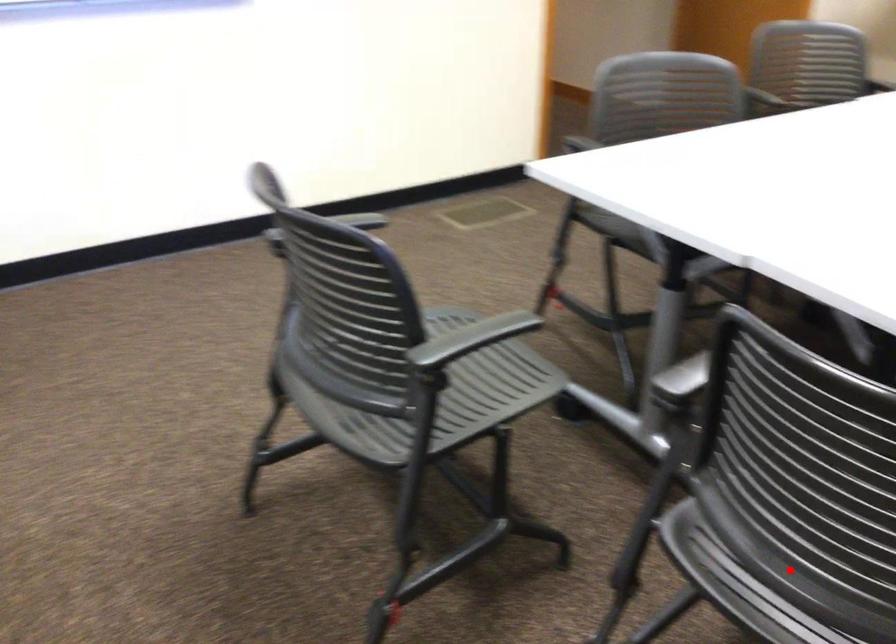
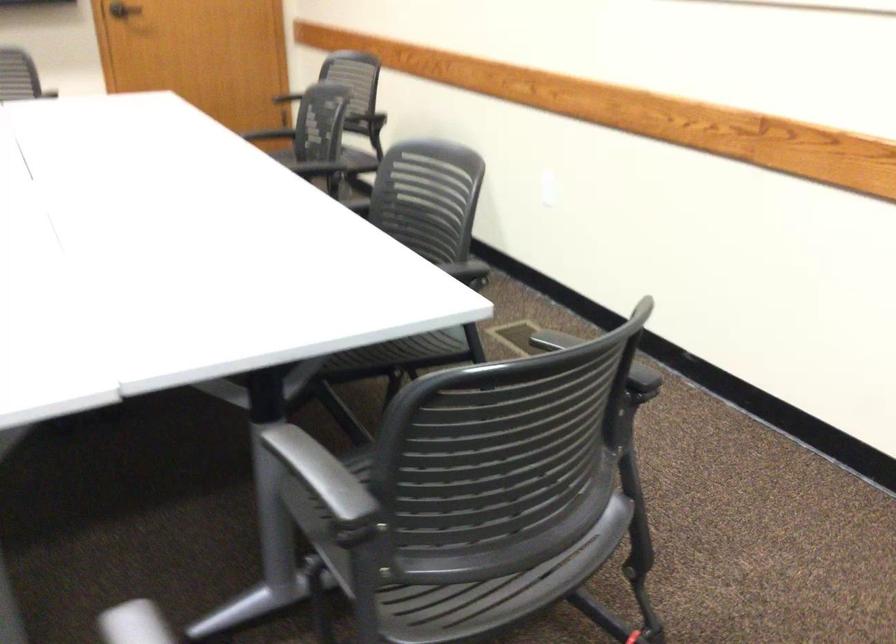
Question: I am providing you with two images of the same scene from different viewpoints. In image1, a red point is highlighted. Considering the same 3D point in image2, which of the following is correct?

Choices:
 (A) It is closer
 (B) It is farther

Answer: (B)